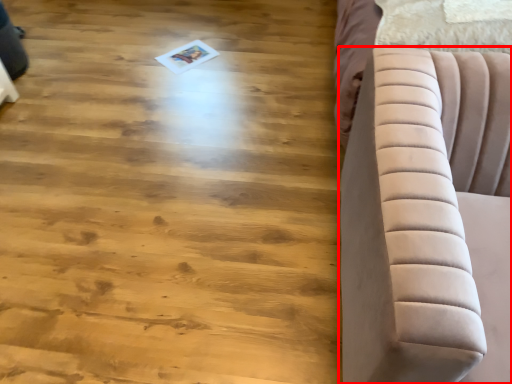
Question: From the image's perspective, what is the correct spatial relationship of furniture (annotated by the red box) in relation to hardwood?

Choices:
 (A) above
 (B) below

Answer: (B)